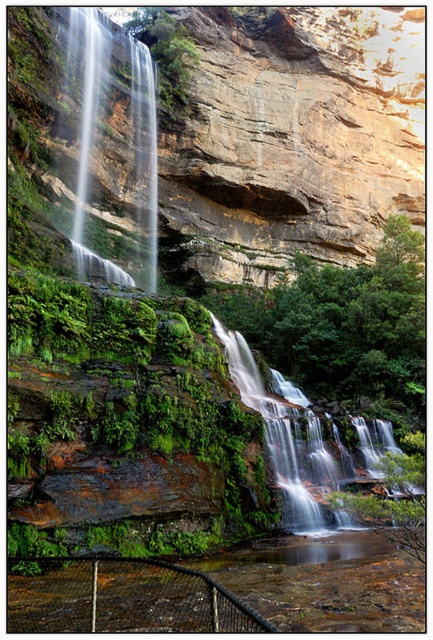
You are a photographer planning to capture the waterfall. You notice two distinct water sections at the center of the scene. Which one is wider between the white frothy water at center and the clear water at center?

The white frothy water at center is wider than the clear water at center.

You are a drone operator planning to capture aerial footage of the rustic stone cliff at upper center. Your drone has a maximum flight range of 40 meters. Can your drone safely reach the cliff and return without exceeding its range limit?

The distance of rustic stone cliff at upper center from camera is 37.64 meters. Since the drone can fly up to 40 meters, it can safely reach the cliff and return as the round trip distance would be 75.28 meters, which is within the 80 meters range of the drone.

You are a photographer planning to capture the waterfall. You notice two types of water in the scene. Which one is smaller in size between the white frothy water at center and the clear water at center?

The white frothy water at center has a smaller size compared to clear water at center.